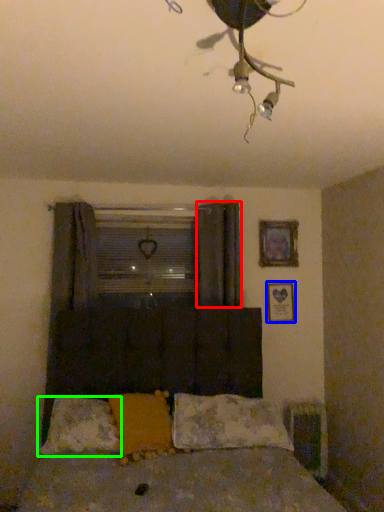
Question: Which object is positioned closest to curtain (highlighted by a red box)? Select from picture frame (highlighted by a blue box) and pillow (highlighted by a green box).

Choices:
 (A) picture frame
 (B) pillow

Answer: (A)